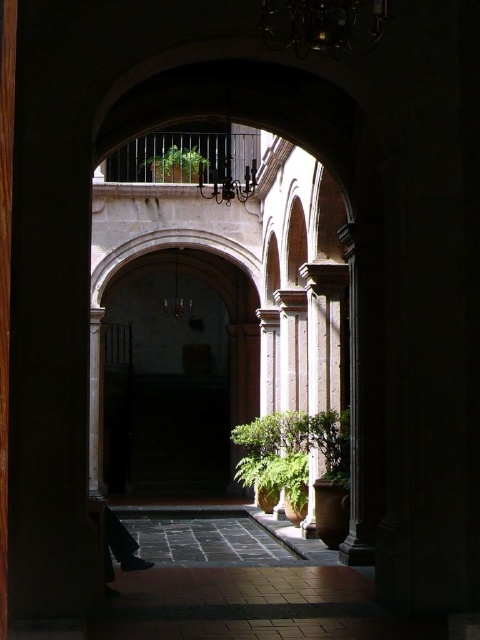
You are standing at the entrance of the courtyard and want to walk towards the smooth stone archway at center. Which direction should you move?

You should move forward towards the center of the courtyard to reach the smooth stone archway at center.

You are standing in the courtyard and want to take a photo of the green leafy plant at center and the green leafy plant at upper center. Which one will appear closer to the camera in the photo?

The green leafy plant at center will appear closer to the camera in the photo because it is positioned in front of the green leafy plant at upper center.